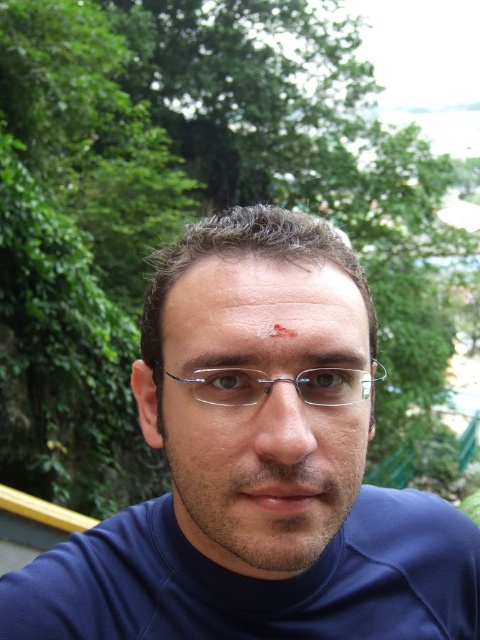
Question: Can you confirm if matte skin scar at center is positioned to the right of brown hair at upper center?

Choices:
 (A) no
 (B) yes

Answer: (B)

Question: Does matte blue shirt at center have a lesser width compared to clear plastic glasses at center?

Choices:
 (A) no
 (B) yes

Answer: (A)

Question: Which object is the farthest from the matte skin scar at center?

Choices:
 (A) matte glass nose at center
 (B) brown hair at upper center
 (C) clear plastic glasses at center

Answer: (C)

Question: Does matte skin scar at center have a larger size compared to brown hair at upper center?

Choices:
 (A) no
 (B) yes

Answer: (B)

Question: Which object is farther from the camera taking this photo?

Choices:
 (A) matte glass nose at center
 (B) matte skin scar at center

Answer: (B)

Question: Which is nearer to the matte blue shirt at center?

Choices:
 (A) brown hair at upper center
 (B) matte skin scar at center
 (C) clear plastic glasses at center

Answer: (B)